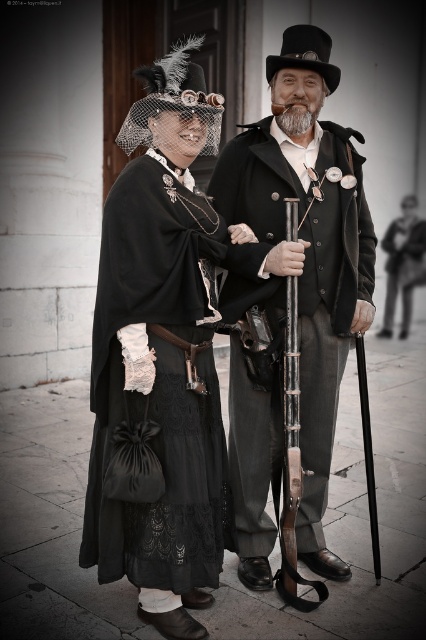
You are standing at the origin point in the image and want to move towards the two points labeled point (253, 180) and point (149, 304). Which point should you reach first based on their positions?

Point (149, 304) should be reached first because it is in front of point (253, 180) from the observer perspective.

You are a photographer setting up a shoot in front of a stone building. You have two subjects dressed in period attire. The first is wearing a matte black coat at center, and the second is in a black lace dress at left. To ensure proper lighting, you need to know which subject is closer to the camera. Based on their positions, which one is in front?

The matte black coat at center is positioned over the black lace dress at left, meaning the matte black coat at center is closer to the camera.

You are a tailor observing the two black garments in the scene. Which one is taller, the matte black coat at center or the black lace dress at left?

The matte black coat at center is taller than the black lace dress at left.